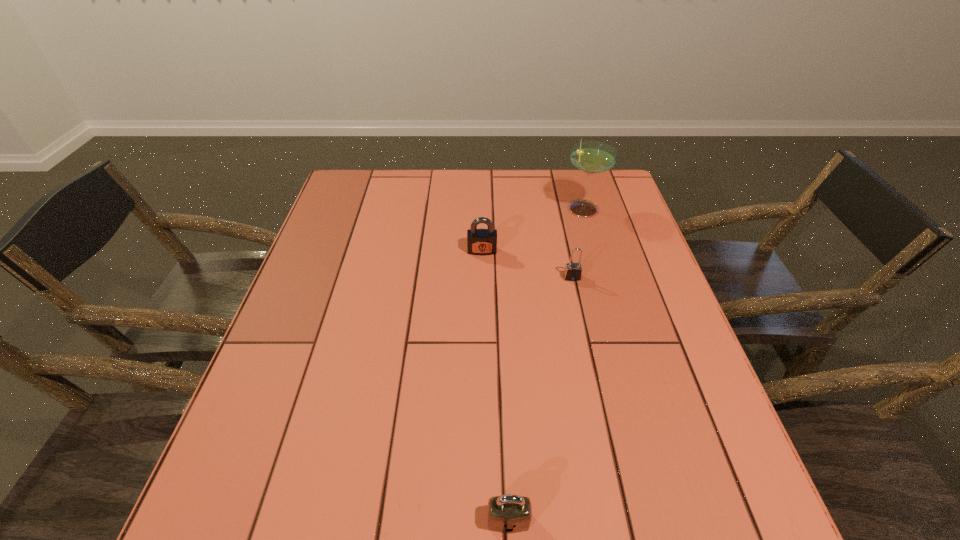
Locate which padlock ranks in proximity to the martini. Please provide its 2D coordinates. Your answer should be formatted as a tuple, i.e. [(x, y)], where the tuple contains the x and y coordinates of a point satisfying the conditions above.

[(573, 271)]